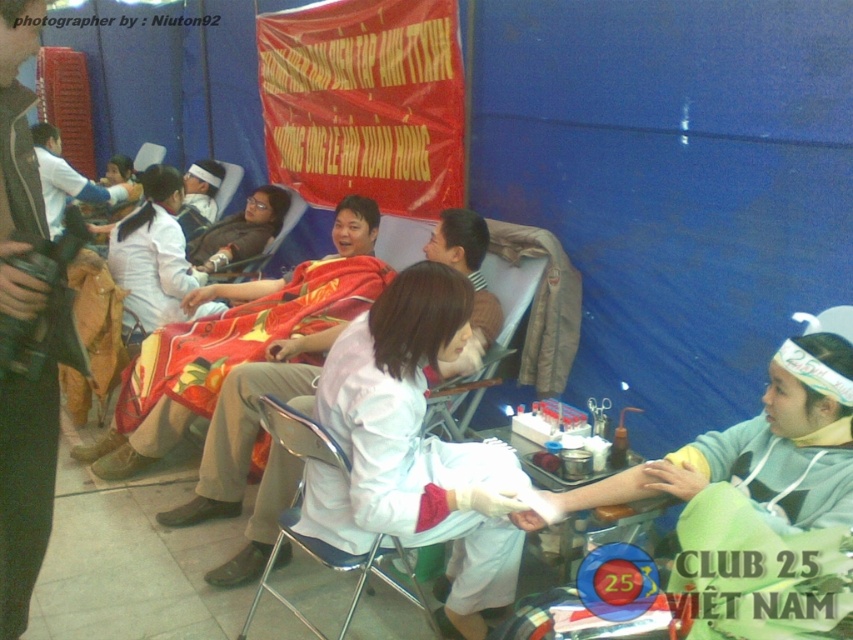
You are standing at the entrance of the blood donation event and notice two points marked on the floor. The first is at point [196,244] and the second is at point [62,205]. Which point is closer to you?

Point [196,244] is closer to the viewer than point [62,205].

You are a volunteer at the blood donation event. You need to hand out a form to the person wearing the matte black jacket at center and the white matte coat at upper left. Which one is closer to you if you are standing at the entrance facing the scene?

The matte black jacket at center is closer to you because it is positioned under the white matte coat at upper left, meaning it is lower in the scene and thus nearer when facing the image.